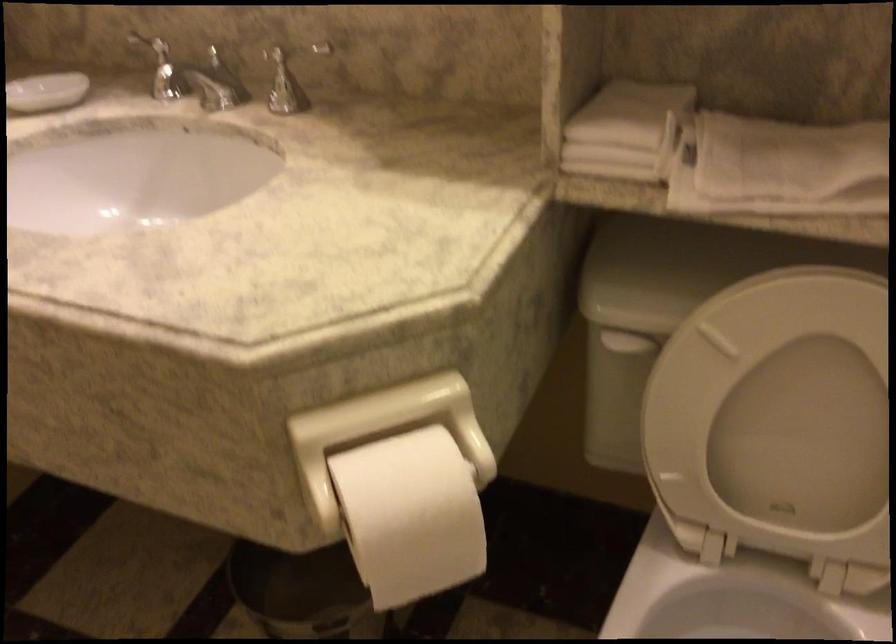
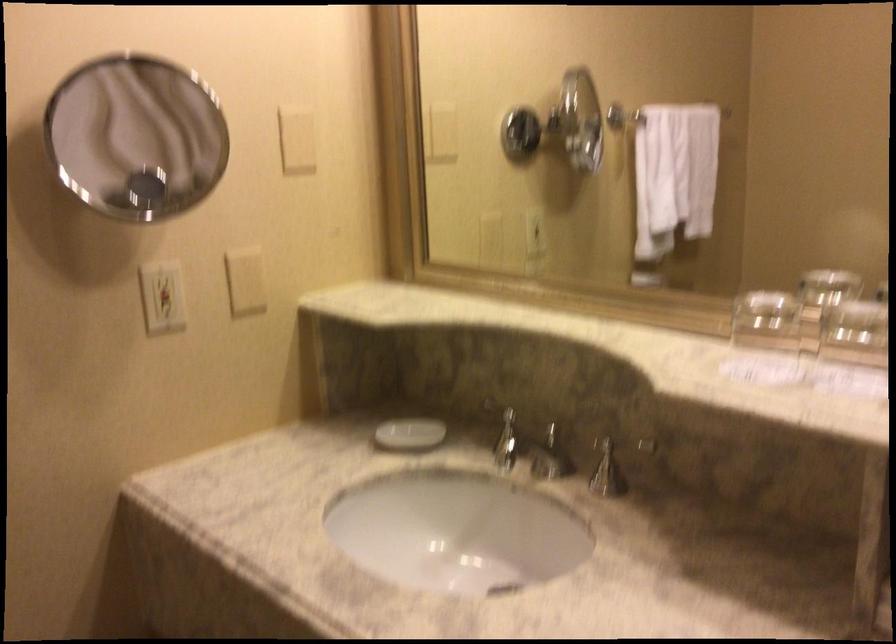
The first image is from the beginning of the video and the second image is from the end. How did the camera likely rotate when shooting the video?

The rotation direction of the camera is left-up.